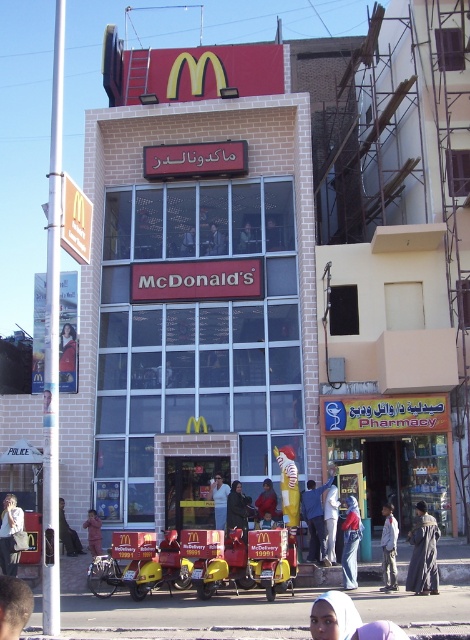
Question: Can you confirm if light brown leather jacket at lower left is bigger than blue denim jeans at lower center?

Choices:
 (A) yes
 (B) no

Answer: (A)

Question: Is the position of light brown leather jacket at lower left less distant than that of dark brown leather jacket at lower left?

Choices:
 (A) yes
 (B) no

Answer: (A)

Question: Which point appears farthest from the camera in this image?

Choices:
 (A) (435, 589)
 (B) (271, 524)
 (C) (86, 520)

Answer: (C)

Question: Based on their relative distances, which object is farther from the light brown fabric shirt at center?

Choices:
 (A) blue denim jeans at center
 (B) light purple fabric headscarf at lower center
 (C) red fabric person at lower left

Answer: (B)

Question: Which point is closer to the camera taking this photo?

Choices:
 (A) (435, 576)
 (B) (335, 596)

Answer: (B)

Question: Is blue denim jeans at center to the right of light blue denim jacket at lower right from the viewer's perspective?

Choices:
 (A) yes
 (B) no

Answer: (B)